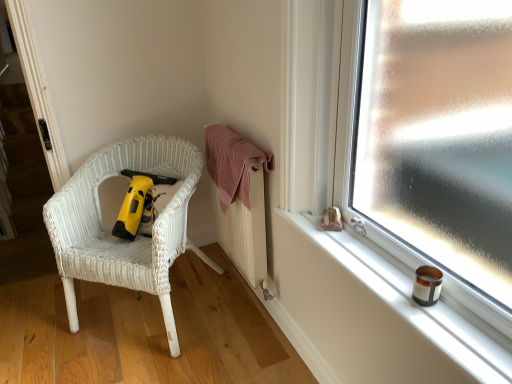
Question: Based on their sizes in the image, would you say yellow plastic vacuum at left is bigger or smaller than smooth white window sill at right?

Choices:
 (A) small
 (B) big

Answer: (B)

Question: Is point (126, 236) closer or farther from the camera than point (450, 317)?

Choices:
 (A) closer
 (B) farther

Answer: (B)

Question: Which is farther from the yellow plastic vacuum at left?

Choices:
 (A) white wicker chair at left
 (B) pink cotton towel at center
 (C) smooth white window sill at right

Answer: (C)

Question: Estimate the real-world distances between objects in this image. Which object is farther from the white wicker chair at left?

Choices:
 (A) yellow plastic vacuum at left
 (B) smooth white window sill at right
 (C) pink cotton towel at center

Answer: (B)